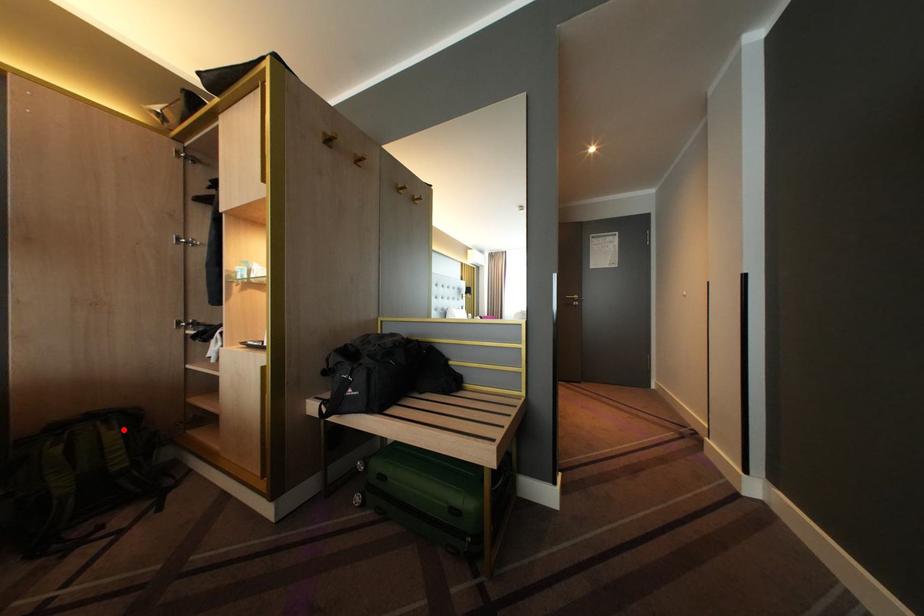
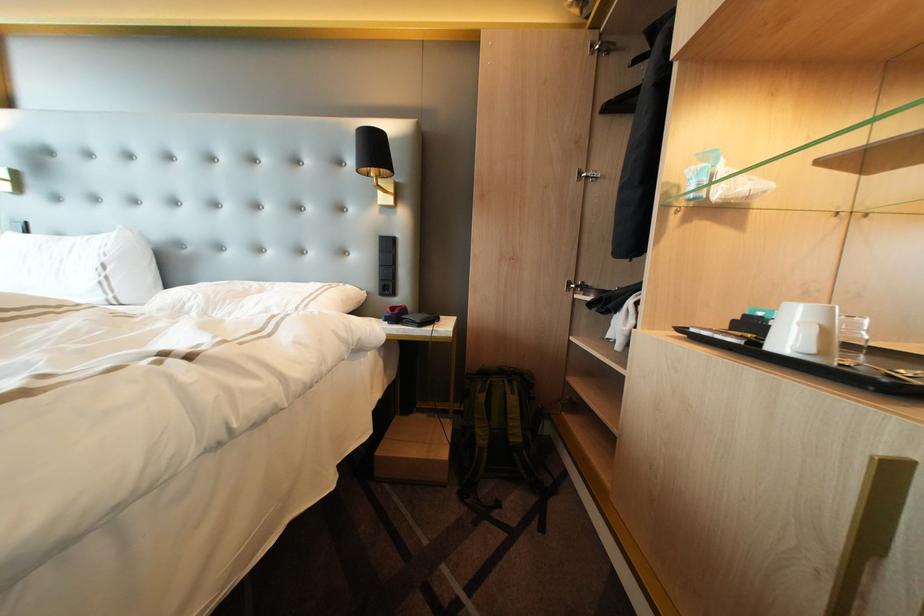
Question: I am providing you with two images of the same scene from different viewpoints. In image1, a red point is highlighted. Considering the same 3D point in image2, which of the following is correct?

Choices:
 (A) It is closer
 (B) It is farther

Answer: (B)